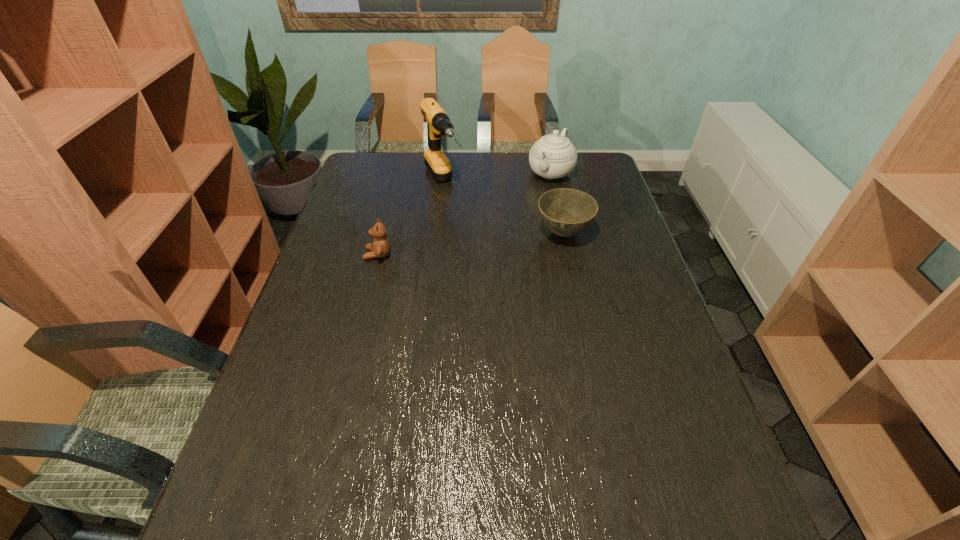
Identify the location of teddy bear. (380, 248).

Find the location of a particular element. The image size is (960, 540). bowl is located at coordinates click(566, 212).

Locate an element on the screen. The image size is (960, 540). the tallest object is located at coordinates (438, 123).

Where is `the third object from right to left`? The height and width of the screenshot is (540, 960). the third object from right to left is located at coordinates (438, 123).

At what (x,y) coordinates should I click in order to perform the action: click on the third shortest object. Please return your answer as a coordinate pair (x, y). The image size is (960, 540). Looking at the image, I should click on (553, 156).

Locate an element on the screen. vacant area located 0.100m on the face of the teddy bear is located at coordinates (330, 254).

Identify the location of vacant space located on the back of the bowl. Image resolution: width=960 pixels, height=540 pixels. (546, 156).

Locate an element on the screen. The image size is (960, 540). vacant position located 0.400m at the tip of the tallest object is located at coordinates (502, 286).

Where is `vacant space located at the tip of the tallest object`? This screenshot has height=540, width=960. vacant space located at the tip of the tallest object is located at coordinates (498, 281).

Where is `vacant region located 0.260m at the tip of the tallest object`? vacant region located 0.260m at the tip of the tallest object is located at coordinates click(x=481, y=254).